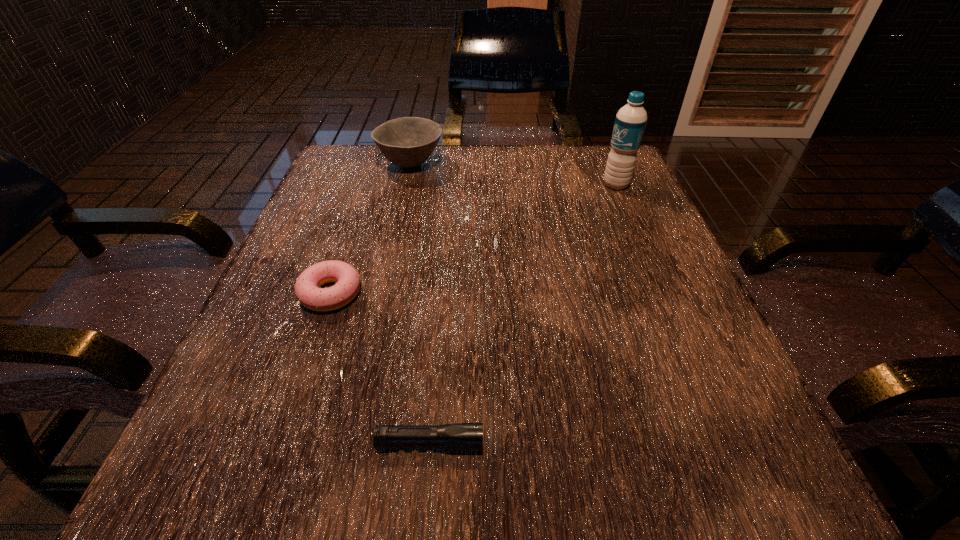
You are a GUI agent. You are given a task and a screenshot of the screen. Output one action in this format:
    pyautogui.click(x=<x>, y=<y>)
    Task: Click on the object positioned at the far right corner
    This screenshot has height=540, width=960.
    Given the screenshot: What is the action you would take?
    pyautogui.click(x=630, y=122)

Where is `vacant space at the far edge of the desktop`? The height and width of the screenshot is (540, 960). vacant space at the far edge of the desktop is located at coordinates (492, 156).

Find the location of a particular element. The image size is (960, 540). vacant area at the near edge is located at coordinates (574, 454).

This screenshot has height=540, width=960. In order to click on free space at the left edge in this screenshot , I will do `click(266, 383)`.

Identify the location of vacant space at the right edge. (616, 360).

Find the location of a particular element. This screenshot has width=960, height=540. vacant space at the far left corner is located at coordinates (386, 195).

Locate an element on the screen. This screenshot has height=540, width=960. free spot between the third tallest object and the flashlight is located at coordinates (380, 368).

Where is `free space between the second tallest object and the flashlight`? This screenshot has width=960, height=540. free space between the second tallest object and the flashlight is located at coordinates (420, 303).

Identify the location of vacant space that's between the bowl and the rightmost object. Image resolution: width=960 pixels, height=540 pixels. (514, 174).

The image size is (960, 540). I want to click on free space between the shortest object and the water bottle, so tap(523, 314).